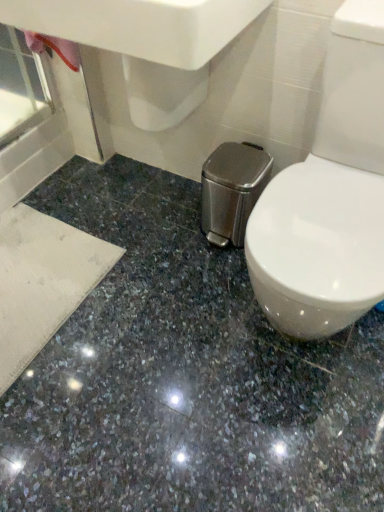
Where is `vacant area on top of shiny granite floor at center (from a real-world perspective)`? This screenshot has height=512, width=384. vacant area on top of shiny granite floor at center (from a real-world perspective) is located at coordinates (167, 347).